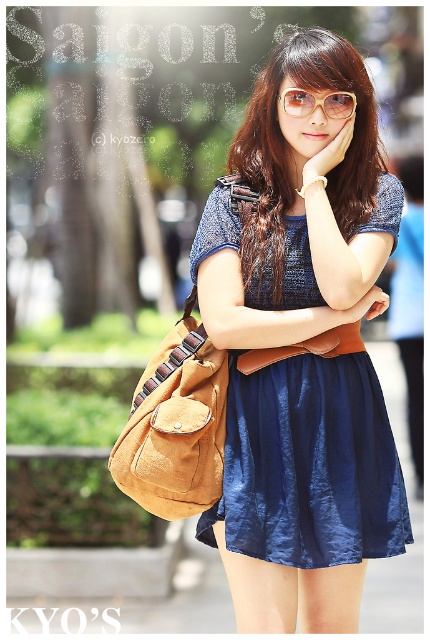
Is suede brown shoulder bag at center in front of translucent yellow plastic glasses at upper center?

Yes, suede brown shoulder bag at center is closer to the viewer.

Based on the photo, is suede brown shoulder bag at center to the right of translucent yellow plastic glasses at upper center from the viewer's perspective?

Incorrect, suede brown shoulder bag at center is not on the right side of translucent yellow plastic glasses at upper center.

Does point (149, 486) lie behind point (355, 99)?

No, (149, 486) is closer to viewer.

Find the location of `suede brown shoulder bag at center`. suede brown shoulder bag at center is located at coordinates (175, 426).

Can you confirm if matte blue dress at center is positioned above translucent yellow plastic glasses at upper center?

No.

Is point (365, 179) positioned in front of point (310, 99)?

No, (365, 179) is behind (310, 99).

Where is `matte blue dress at center`? The width and height of the screenshot is (430, 640). matte blue dress at center is located at coordinates (285, 145).

Does point (197, 532) come behind point (294, 102)?

That is True.

Based on the photo, who is higher up, satin blue skirt at center or translucent yellow plastic glasses at upper center?

translucent yellow plastic glasses at upper center is higher up.

Who is more forward, (332,412) or (340,109)?

Positioned in front is point (332,412).

Locate an element on the screen. The height and width of the screenshot is (640, 430). satin blue skirt at center is located at coordinates (310, 465).